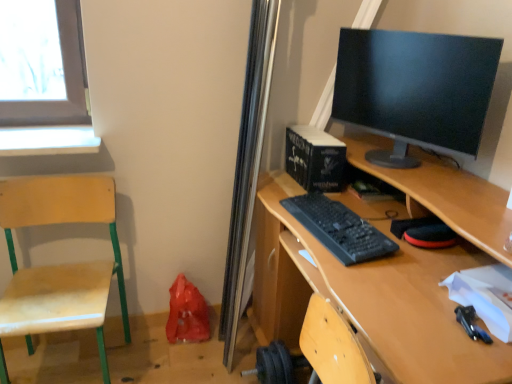
Question: Can you confirm if wooden swivel chair at left is positioned to the left of black glossy monitor at upper right?

Choices:
 (A) yes
 (B) no

Answer: (A)

Question: Is the position of wooden swivel chair at left more distant than that of black glossy monitor at upper right?

Choices:
 (A) no
 (B) yes

Answer: (B)

Question: From a real-world perspective, is wooden swivel chair at left on top of black glossy monitor at upper right?

Choices:
 (A) no
 (B) yes

Answer: (A)

Question: From a real-world perspective, is wooden swivel chair at left beneath black glossy monitor at upper right?

Choices:
 (A) no
 (B) yes

Answer: (B)

Question: Is wooden swivel chair at left smaller than black glossy monitor at upper right?

Choices:
 (A) no
 (B) yes

Answer: (A)

Question: Is wooden swivel chair at left looking in the opposite direction of black glossy monitor at upper right?

Choices:
 (A) no
 (B) yes

Answer: (A)

Question: Is black plastic keyboard at center in front of wooden swivel chair at left?

Choices:
 (A) yes
 (B) no

Answer: (A)

Question: From the image's perspective, is black plastic keyboard at center below wooden swivel chair at left?

Choices:
 (A) yes
 (B) no

Answer: (B)

Question: From the image's perspective, does black plastic keyboard at center appear higher than wooden swivel chair at left?

Choices:
 (A) no
 (B) yes

Answer: (B)

Question: Can you confirm if black plastic keyboard at center is smaller than wooden swivel chair at left?

Choices:
 (A) no
 (B) yes

Answer: (B)

Question: Is black plastic keyboard at center bigger than wooden swivel chair at left?

Choices:
 (A) no
 (B) yes

Answer: (A)

Question: Is black plastic keyboard at center positioned with its back to wooden swivel chair at left?

Choices:
 (A) no
 (B) yes

Answer: (A)

Question: From the image's perspective, would you say wooden swivel chair at left is positioned over black plastic keyboard at center?

Choices:
 (A) yes
 (B) no

Answer: (B)